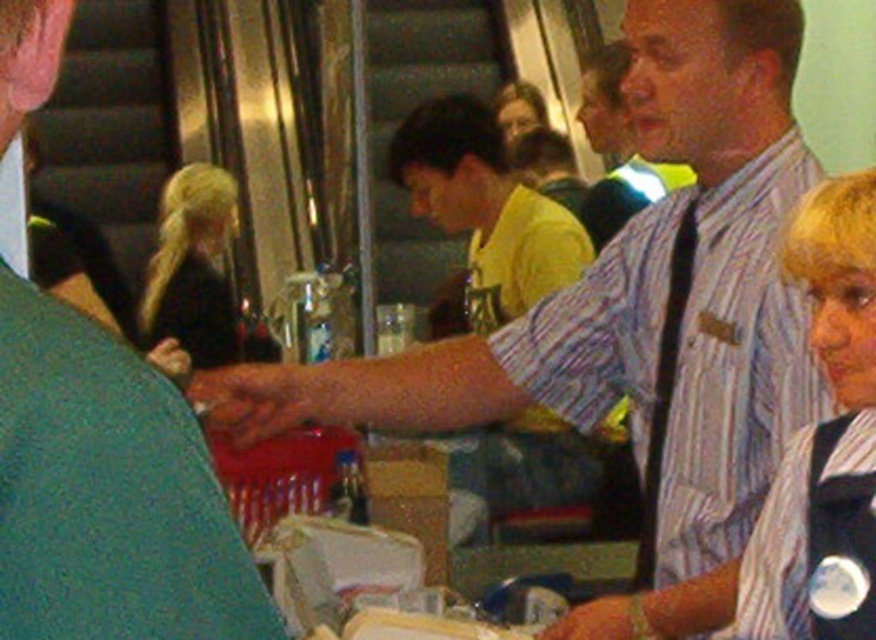
Question: Is matte blue shirt at center wider than yellow matte shirt at center?

Choices:
 (A) yes
 (B) no

Answer: (B)

Question: From the image, what is the correct spatial relationship of matte blue shirt at center in relation to black fabric vest at right?

Choices:
 (A) left
 (B) right

Answer: (A)

Question: Can you confirm if black fabric vest at right is thinner than yellow matte shirt at center?

Choices:
 (A) no
 (B) yes

Answer: (B)

Question: Estimate the real-world distances between objects in this image. Which object is farther from the yellow matte shirt at center?

Choices:
 (A) black fabric vest at right
 (B) matte blue shirt at center

Answer: (B)

Question: Which of the following is the closest to the observer?

Choices:
 (A) (783, 561)
 (B) (521, 262)

Answer: (A)

Question: Which point is closer to the camera?

Choices:
 (A) matte blue shirt at center
 (B) black fabric vest at right

Answer: (A)